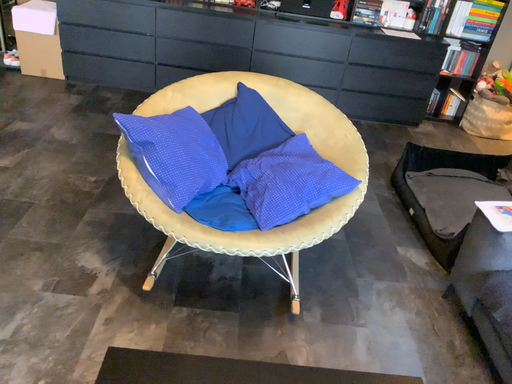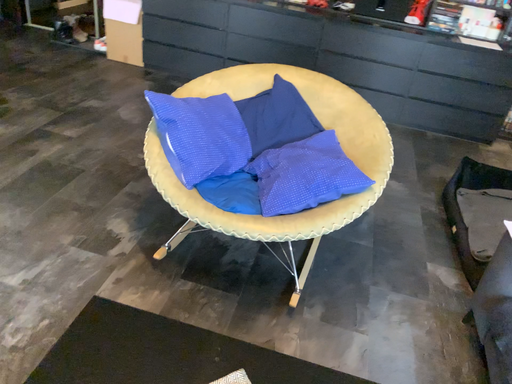
Question: Which way did the camera rotate in the video?

Choices:
 (A) rotated right
 (B) rotated left

Answer: (B)